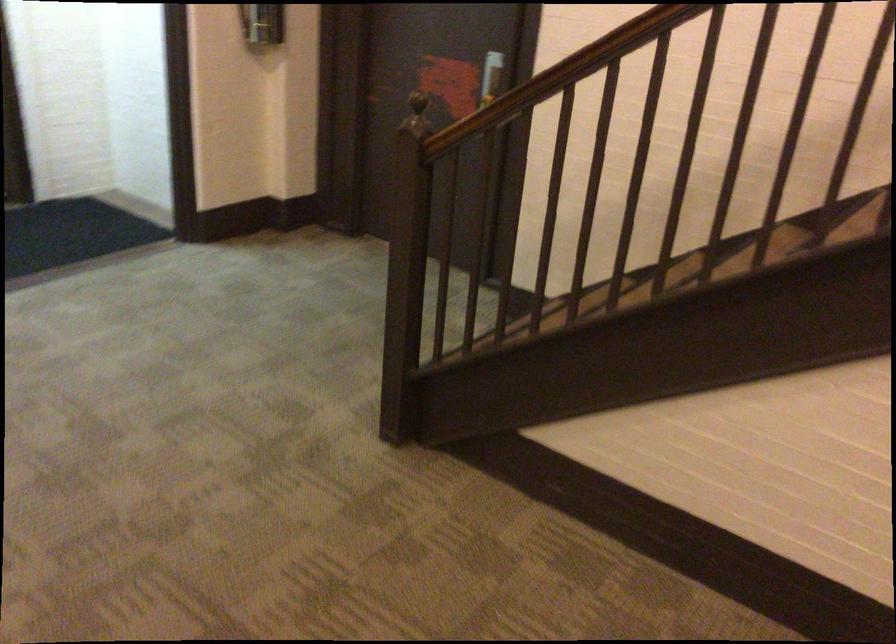
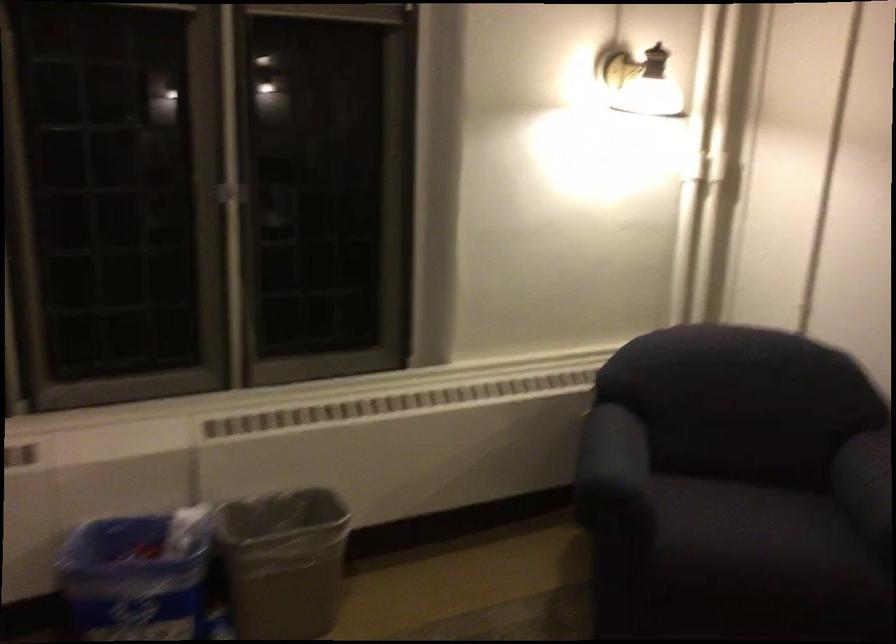
Question: The images are taken continuously from a first-person perspective. In which direction are you moving?

Choices:
 (A) Left
 (B) Right
 (C) Forward
 (D) Backward

Answer: (A)